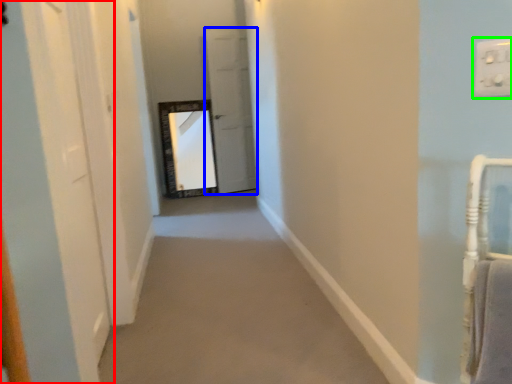
Question: Which object is positioned closest to door (highlighted by a red box)? Select from door (highlighted by a blue box) and electric outlet (highlighted by a green box).

Choices:
 (A) door
 (B) electric outlet

Answer: (B)